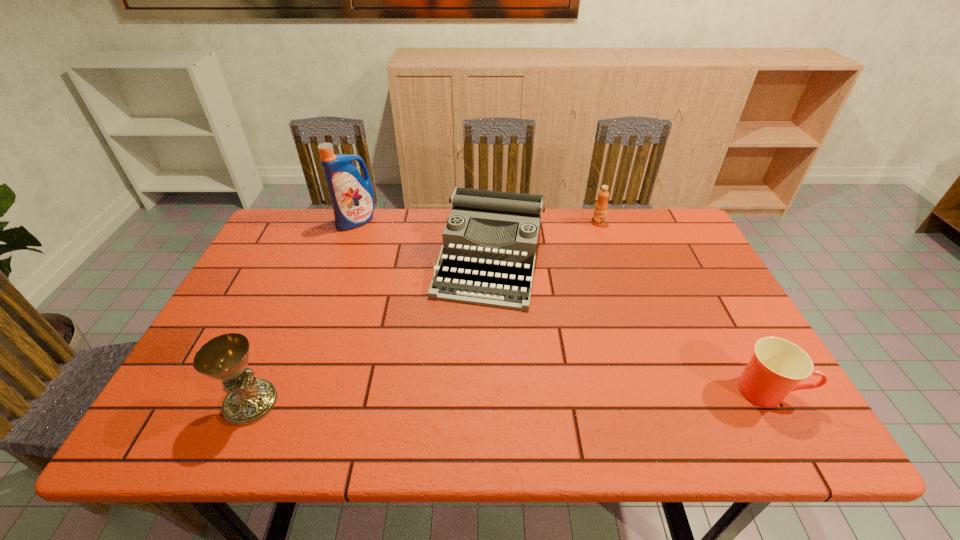
Locate an element on the screen. This screenshot has width=960, height=540. free spot located 0.180m on the label of the tallest object is located at coordinates (377, 264).

At what (x,y) coordinates should I click in order to perform the action: click on vacant space located on the label of the tallest object. Please return your answer as a coordinate pair (x, y). This screenshot has height=540, width=960. Looking at the image, I should click on (367, 241).

The height and width of the screenshot is (540, 960). What are the coordinates of `vacant space located 0.330m on the label of the tallest object` in the screenshot? It's located at (392, 296).

Find the location of a particular element. vacant space located on the front label of the orange juice is located at coordinates (596, 235).

Where is `vacant area located 0.140m on the front label of the orange juice`? The width and height of the screenshot is (960, 540). vacant area located 0.140m on the front label of the orange juice is located at coordinates (592, 252).

Find the location of `vacant region located 0.230m on the front label of the orange juice`. vacant region located 0.230m on the front label of the orange juice is located at coordinates (589, 272).

Where is `typewriter located at the far edge`? typewriter located at the far edge is located at coordinates (490, 240).

At what (x,y) coordinates should I click in order to perform the action: click on detergent situated at the far edge. Please return your answer as a coordinate pair (x, y). Image resolution: width=960 pixels, height=540 pixels. Looking at the image, I should click on (352, 197).

Identify the location of orange juice present at the far edge. (601, 206).

Locate an element on the screen. The image size is (960, 540). chalice that is positioned at the near edge is located at coordinates (225, 357).